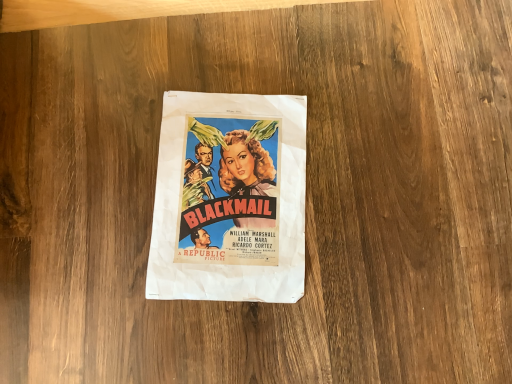
Locate an element on the screen. matte paper poster at center is located at coordinates (229, 199).

The height and width of the screenshot is (384, 512). What do you see at coordinates (229, 199) in the screenshot?
I see `matte paper poster at center` at bounding box center [229, 199].

Locate an element on the screen. The height and width of the screenshot is (384, 512). matte paper poster at center is located at coordinates (229, 199).